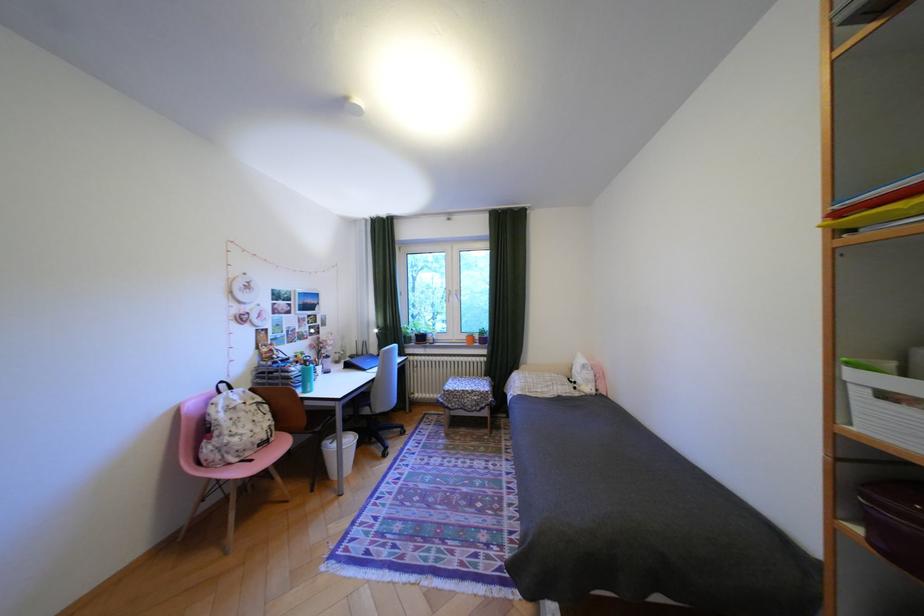
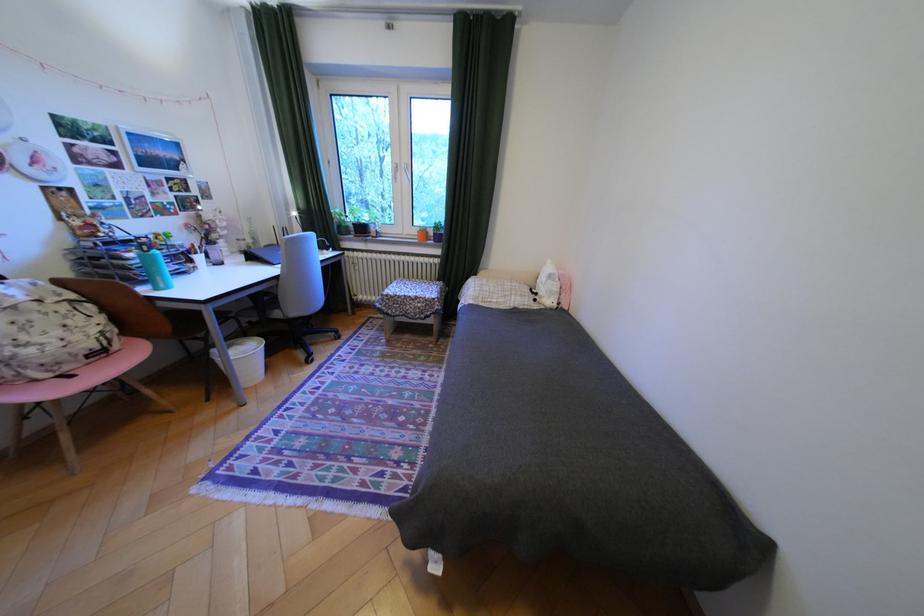
Locate, in the second image, the point that corresponds to the point at 476,337 in the first image.

(427, 232)